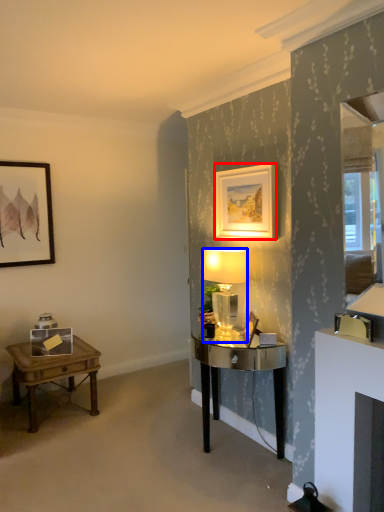
Question: Which object is closer to the camera taking this photo, picture frame (highlighted by a red box) or lamp (highlighted by a blue box)?

Choices:
 (A) picture frame
 (B) lamp

Answer: (A)